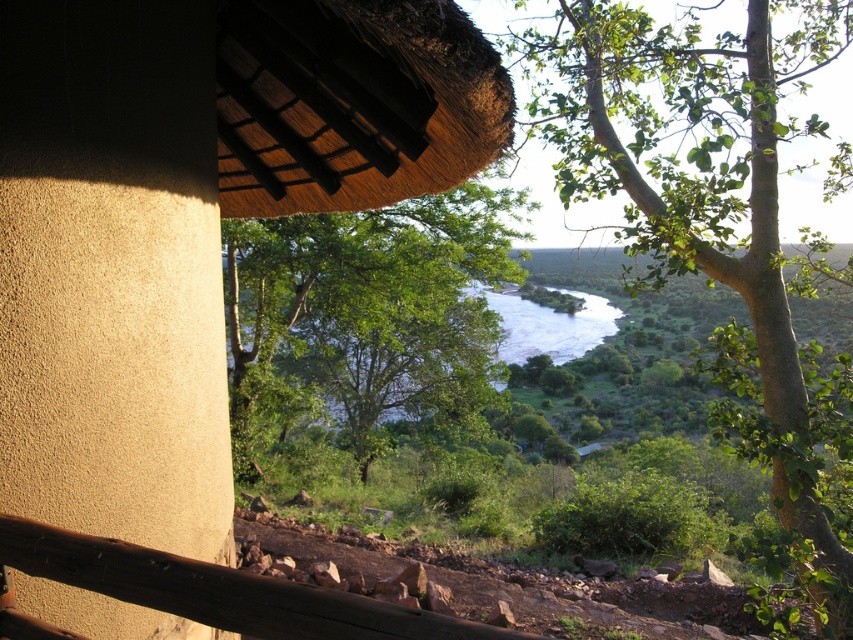
Is green leafy tree at upper right taller than green leafy tree at center?

Indeed, green leafy tree at upper right has a greater height compared to green leafy tree at center.

Is point (747, 332) less distant than point (369, 365)?

Yes.

This screenshot has width=853, height=640. Describe the element at coordinates (717, 237) in the screenshot. I see `green leafy tree at upper right` at that location.

The height and width of the screenshot is (640, 853). Find the location of `green leafy tree at upper right`. green leafy tree at upper right is located at coordinates (717, 237).

Between green leafy tree at center and brown wooden rail at lower center, which one is positioned lower?

brown wooden rail at lower center

Is point (395, 208) positioned behind point (392, 637)?

Yes.

Locate an element on the screen. Image resolution: width=853 pixels, height=640 pixels. green leafy tree at center is located at coordinates pos(364,316).

Does thatched roof hut at upper center appear over brown wooden rail at lower center?

Indeed, thatched roof hut at upper center is positioned over brown wooden rail at lower center.

Who is higher up, thatched roof hut at upper center or brown wooden rail at lower center?

thatched roof hut at upper center is above.

Is point (225, 163) closer to viewer compared to point (286, 636)?

No, it is not.

Identify the location of thatched roof hut at upper center. This screenshot has height=640, width=853. (189, 218).